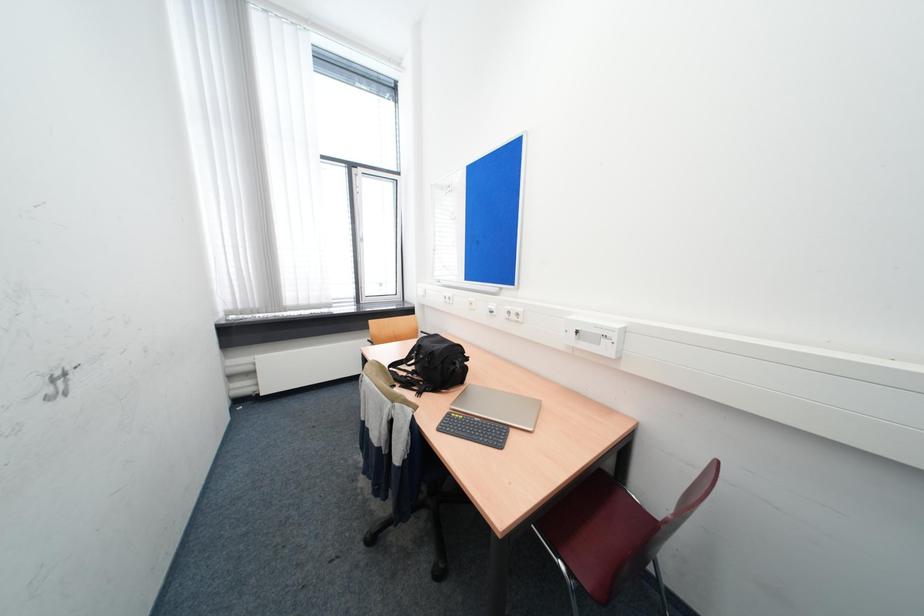
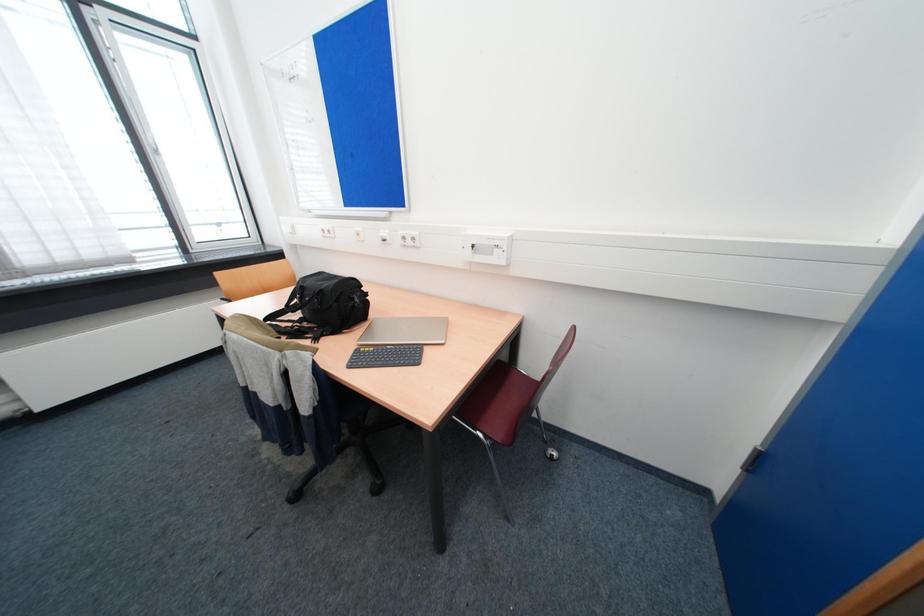
In a continuous first-person perspective shot, in which direction is the camera moving?

The movement direction of the cameraman is left, forward.